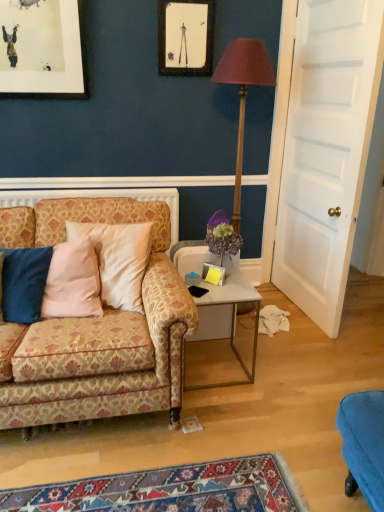
Where is `vacant region in front of white glossy side table at center`? The width and height of the screenshot is (384, 512). vacant region in front of white glossy side table at center is located at coordinates (223, 411).